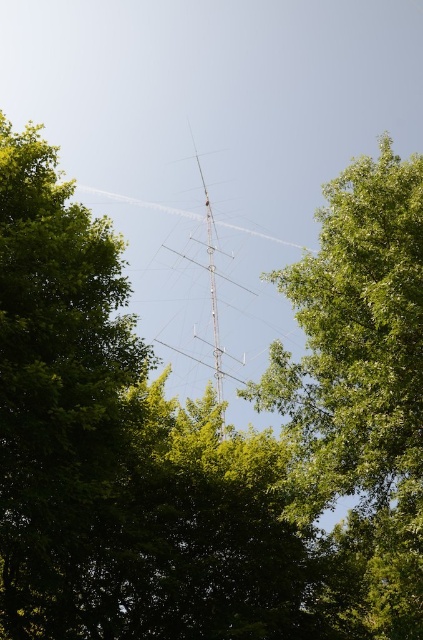
You are a bird flying over a field and see the green leafy tree at center and the silver metallic antenna at center. Which object would you prefer to land on for a better view of the surroundings?

→ The green leafy tree at center has a larger size compared to the silver metallic antenna at center, so landing on the green leafy tree at center would provide a better vantage point for observing the surroundings.

You are an amateur radio operator planning to install a new antenna. You have a space where a green leafy tree at center and a silver metallic antenna at center are present. Which object is wider?

The green leafy tree at center is wider than the silver metallic antenna at center according to the description.